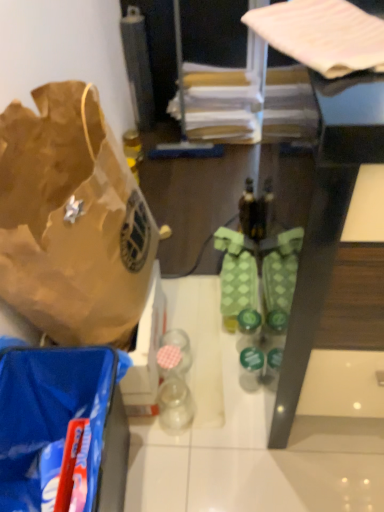
Question: Is matte brown wrapping paper at upper center, the second wrapping paper in the front-to-back sequence, not close to brown paper bag at left?

Choices:
 (A) yes
 (B) no

Answer: (A)

Question: From the image's perspective, would you say matte brown wrapping paper at upper center, the second wrapping paper in the front-to-back sequence, is shown under brown paper bag at left?

Choices:
 (A) yes
 (B) no

Answer: (B)

Question: Is matte brown wrapping paper at upper center, the second wrapping paper in the front-to-back sequence, positioned in front of brown paper bag at left?

Choices:
 (A) no
 (B) yes

Answer: (A)

Question: Considering the relative sizes of matte brown wrapping paper at upper center, the second wrapping paper in the front-to-back sequence, and brown paper bag at left in the image provided, is matte brown wrapping paper at upper center, the second wrapping paper in the front-to-back sequence, shorter than brown paper bag at left?

Choices:
 (A) no
 (B) yes

Answer: (B)

Question: From a real-world perspective, is matte brown wrapping paper at upper center, which is counted as the 1th wrapping paper, starting from the back, positioned over brown paper bag at left based on gravity?

Choices:
 (A) no
 (B) yes

Answer: (A)

Question: In the image, is brown paper bag at left positioned in front of or behind green matte bottle at center?

Choices:
 (A) behind
 (B) front

Answer: (B)

Question: Considering the positions of brown paper bag at left and green matte bottle at center in the image, is brown paper bag at left taller or shorter than green matte bottle at center?

Choices:
 (A) short
 (B) tall

Answer: (B)

Question: Would you say brown paper bag at left is to the left or to the right of green matte bottle at center in the picture?

Choices:
 (A) right
 (B) left

Answer: (B)

Question: From a real-world perspective, is brown paper bag at left physically located above or below green matte bottle at center?

Choices:
 (A) above
 (B) below

Answer: (A)

Question: Visually, is brown paper bag at left positioned to the left or to the right of blue plastic bag at lower left?

Choices:
 (A) left
 (B) right

Answer: (A)

Question: Do you think brown paper bag at left is within blue plastic bag at lower left, or outside of it?

Choices:
 (A) outside
 (B) inside

Answer: (A)

Question: From their relative heights in the image, would you say brown paper bag at left is taller or shorter than blue plastic bag at lower left?

Choices:
 (A) short
 (B) tall

Answer: (B)

Question: Considering their positions, is brown paper bag at left located in front of or behind blue plastic bag at lower left?

Choices:
 (A) behind
 (B) front

Answer: (B)

Question: Does point (130, 313) appear closer or farther from the camera than point (266, 23)?

Choices:
 (A) farther
 (B) closer

Answer: (A)

Question: In terms of height, does brown paper bag at left look taller or shorter compared to pink fabric at upper right, arranged as the 2th wrapping paper when viewed from the back?

Choices:
 (A) short
 (B) tall

Answer: (B)